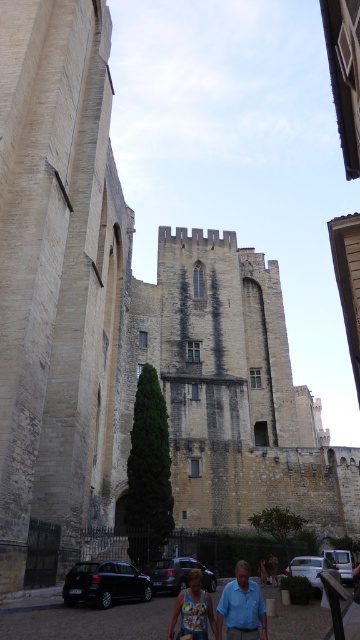
Is printed fabric tank top at lower center to the right of blue denim jeans at lower center from the viewer's perspective?

In fact, printed fabric tank top at lower center is to the left of blue denim jeans at lower center.

Where is `printed fabric tank top at lower center`? This screenshot has height=640, width=360. printed fabric tank top at lower center is located at coordinates (192, 611).

Does blue cotton shirt at lower center appear on the right side of printed fabric tank top at lower center?

Indeed, blue cotton shirt at lower center is positioned on the right side of printed fabric tank top at lower center.

What do you see at coordinates (241, 608) in the screenshot? I see `blue cotton shirt at lower center` at bounding box center [241, 608].

This screenshot has width=360, height=640. I want to click on blue cotton shirt at lower center, so click(x=241, y=608).

Locate an element on the screen. The image size is (360, 640). blue cotton shirt at lower center is located at coordinates (241, 608).

How distant is blue cotton shirt at lower center from blue denim jeans at lower center?

They are 12.74 meters apart.

Who is more forward, (254, 624) or (262, 572)?

Point (254, 624) is in front.

Identify the location of blue cotton shirt at lower center. The image size is (360, 640). (241, 608).